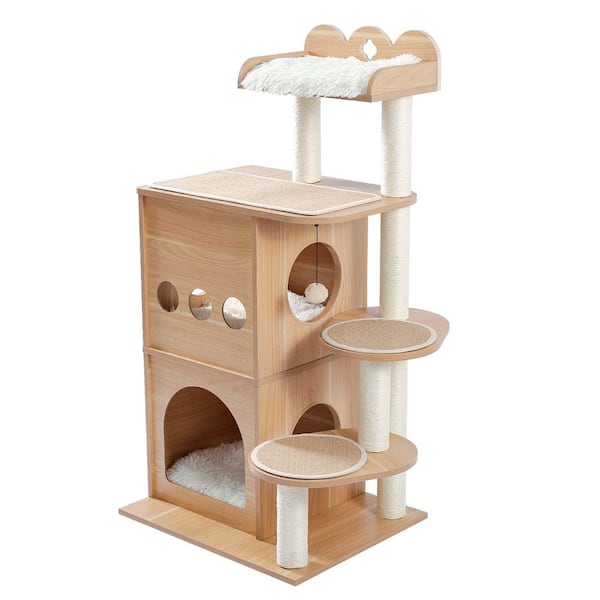
Locate an element on the screen. The height and width of the screenshot is (600, 600). arched entry is located at coordinates (315, 404), (202, 388).